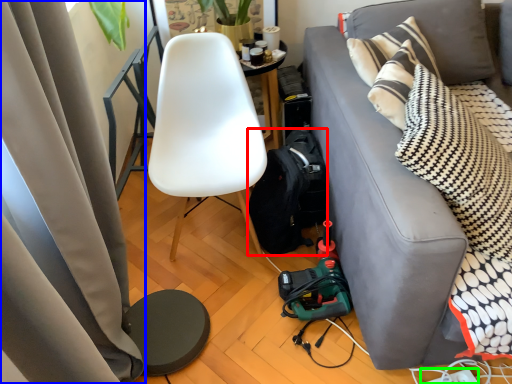
Question: Estimate the real-world distances between objects in this image. Which object is closer to backpack (highlighted by a red box), curtain (highlighted by a blue box) or power outlet (highlighted by a green box)?

Choices:
 (A) curtain
 (B) power outlet

Answer: (A)